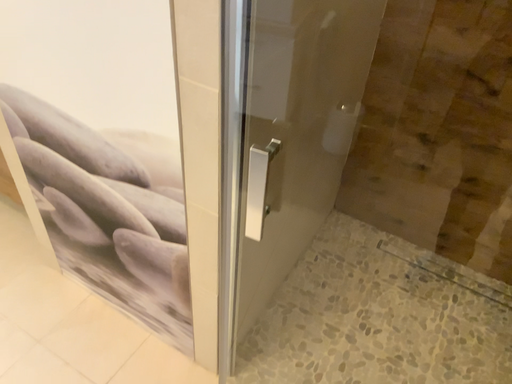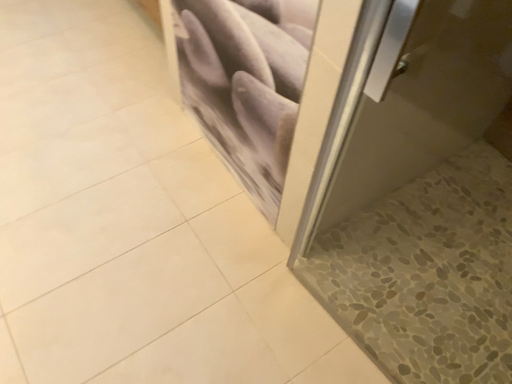
Question: How did the camera likely rotate when shooting the video?

Choices:
 (A) rotated downward
 (B) rotated upward

Answer: (A)